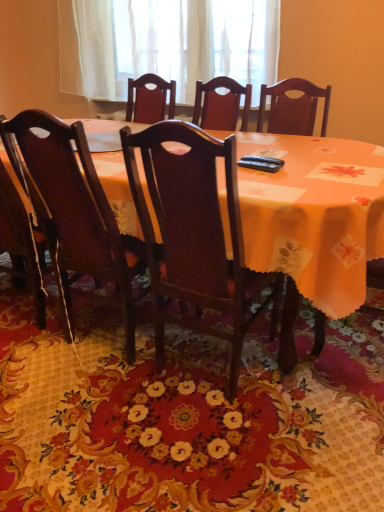
Image resolution: width=384 pixels, height=512 pixels. I want to click on free location to the left of dark wood chair at center, the second chair from the left, so click(104, 398).